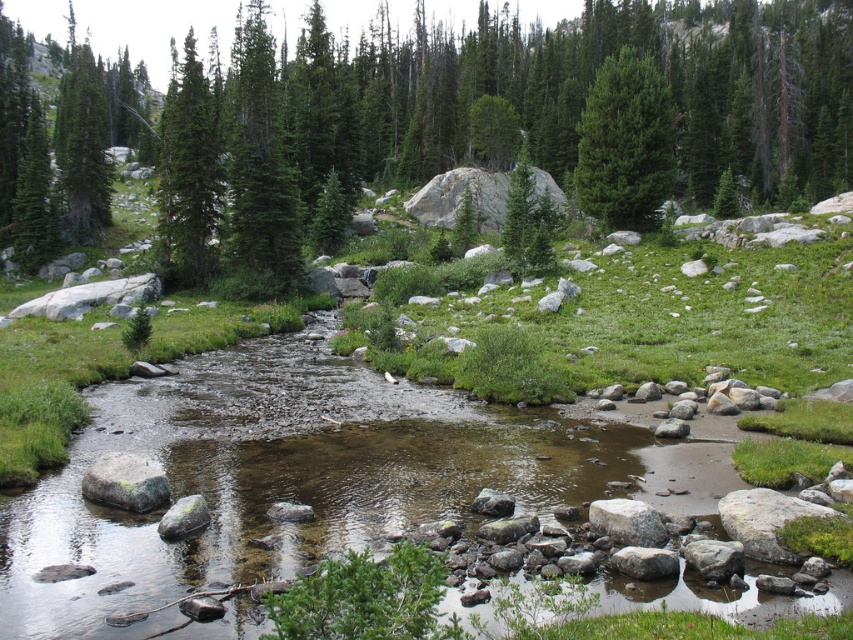
Question: Estimate the real-world distances between objects in this image. Which object is farther from the green matte tree at upper left?

Choices:
 (A) gray rough rock at lower left
 (B) green matte tree at center

Answer: (B)

Question: Where is clear water stream at center located in relation to green matte tree at center in the image?

Choices:
 (A) right
 (B) left

Answer: (B)

Question: Which point appears farthest from the camera in this image?

Choices:
 (A) (186, 522)
 (B) (302, 396)
 (C) (213, 182)

Answer: (C)

Question: Which of the following is the closest to the observer?

Choices:
 (A) gray rough rock at lower left
 (B) clear water stream at center

Answer: (B)

Question: Where is green matte tree at upper center located in relation to smooth gray rock at center in the image?

Choices:
 (A) below
 (B) above

Answer: (B)

Question: Can you confirm if green matte tree at upper left is wider than smooth gray rock at center?

Choices:
 (A) no
 (B) yes

Answer: (B)